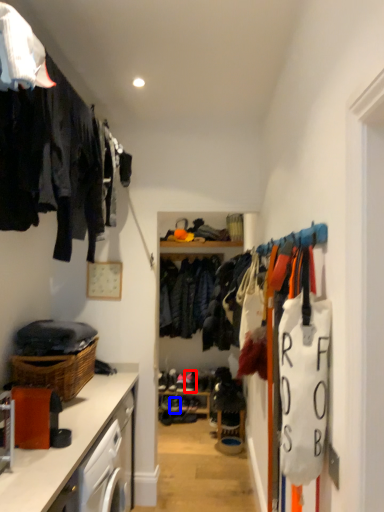
Question: Which of the following is the closest to the observer, shoe (highlighted by a red box) or shoe (highlighted by a blue box)?

Choices:
 (A) shoe
 (B) shoe

Answer: (B)